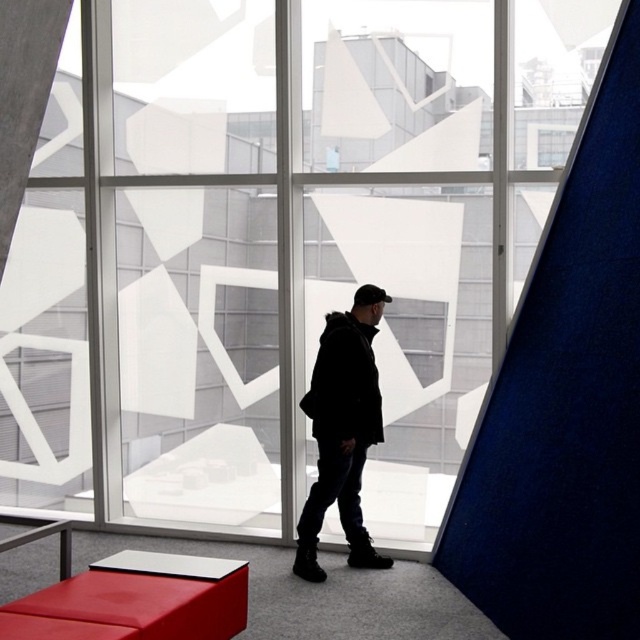
You are standing in the room and want to take a photo of both the point at coordinates point (173, 609) and the point at coordinates point (385, 292). Which point should you focus on first to ensure both are in focus?

You should focus on the point at coordinates point (385, 292) first because it is farther from the camera than the point at coordinates point (173, 609). By focusing on the farther point, both points will be in focus due to the depth of field.

You are standing in the room and want to take a photo of the point at coordinates (324, 392). The camera you have can focus on objects within 10 feet. Will you be able to capture the point clearly in your photo?

The distance between the point at coordinates (324, 392) and the camera is 15.22 feet, which is beyond the camera focus range of 10 feet. Therefore, the point cannot be captured clearly.